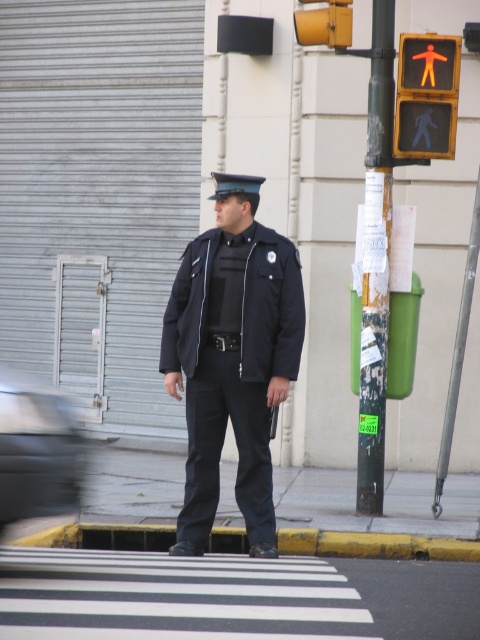
Question: Does matte black uniform at center appear on the left side of orange plastic pedestrian signal at upper right?

Choices:
 (A) no
 (B) yes

Answer: (B)

Question: Which is farther from the orange plastic pedestrian crossing sign at upper center?

Choices:
 (A) matte black uniform at center
 (B) orange plastic pedestrian signal at upper right

Answer: (A)

Question: Based on their relative distances, which object is farther from the orange plastic pedestrian signal at upper right?

Choices:
 (A) yellow matte traffic light at upper center
 (B) matte black uniform at center

Answer: (B)

Question: Which of the following is the farthest from the observer?

Choices:
 (A) orange plastic pedestrian signal at upper right
 (B) orange plastic pedestrian crossing sign at upper center
 (C) yellow matte traffic light at upper center

Answer: (B)

Question: Where is yellow matte traffic light at upper center located in relation to orange plastic pedestrian crossing sign at upper center in the image?

Choices:
 (A) left
 (B) right

Answer: (A)

Question: Can you confirm if matte black uniform at center is positioned below yellow matte traffic light at upper center?

Choices:
 (A) yes
 (B) no

Answer: (A)